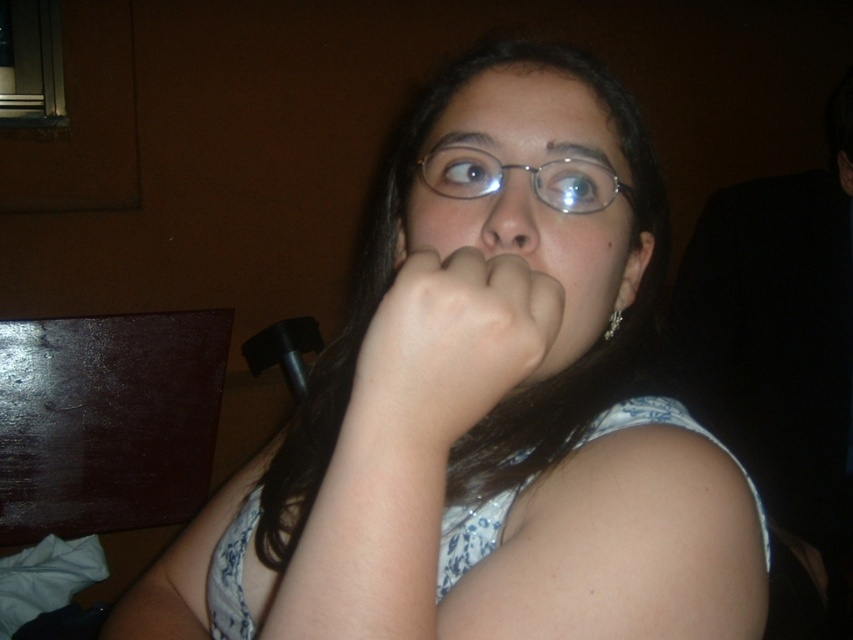
Question: Does white floral dress at center have a greater width compared to pale skin/flesh tone hand at center?

Choices:
 (A) yes
 (B) no

Answer: (A)

Question: Estimate the real-world distances between objects in this image. Which object is farther from the matte glass face at center?

Choices:
 (A) pale skin/flesh tone hand at center
 (B) white floral dress at center
 (C) matte glass nose at center

Answer: (B)

Question: Is pale skin/flesh tone hand at center below matte glass nose at center?

Choices:
 (A) no
 (B) yes

Answer: (B)

Question: Does matte glass face at center appear over metallic wireframe glasses at center?

Choices:
 (A) no
 (B) yes

Answer: (A)

Question: Which is farther from the matte glass face at center?

Choices:
 (A) metallic wireframe glasses at center
 (B) matte glass nose at center
 (C) white floral dress at center

Answer: (C)

Question: Which point is farther to the camera?

Choices:
 (A) (381, 330)
 (B) (476, 147)
 (C) (663, 568)
 (D) (517, 216)

Answer: (B)